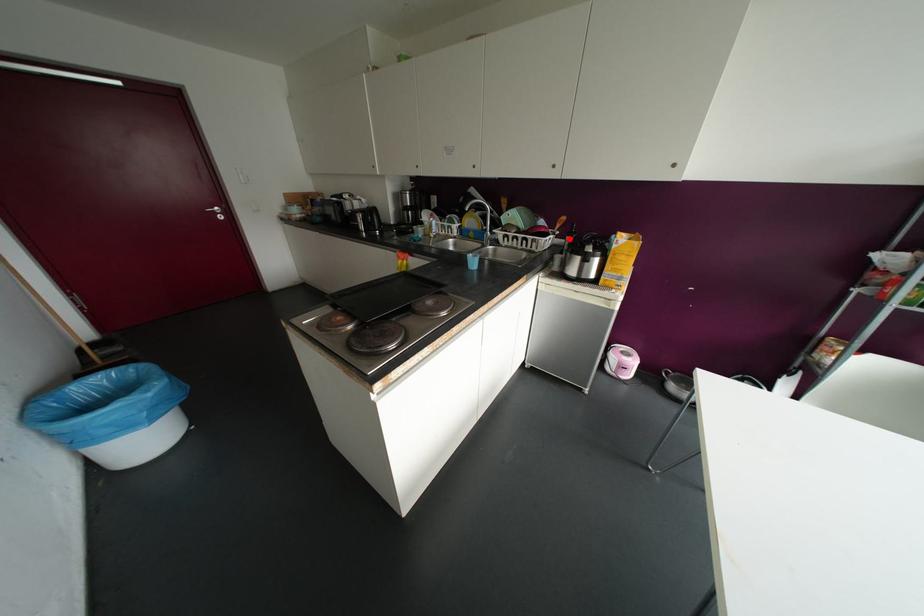
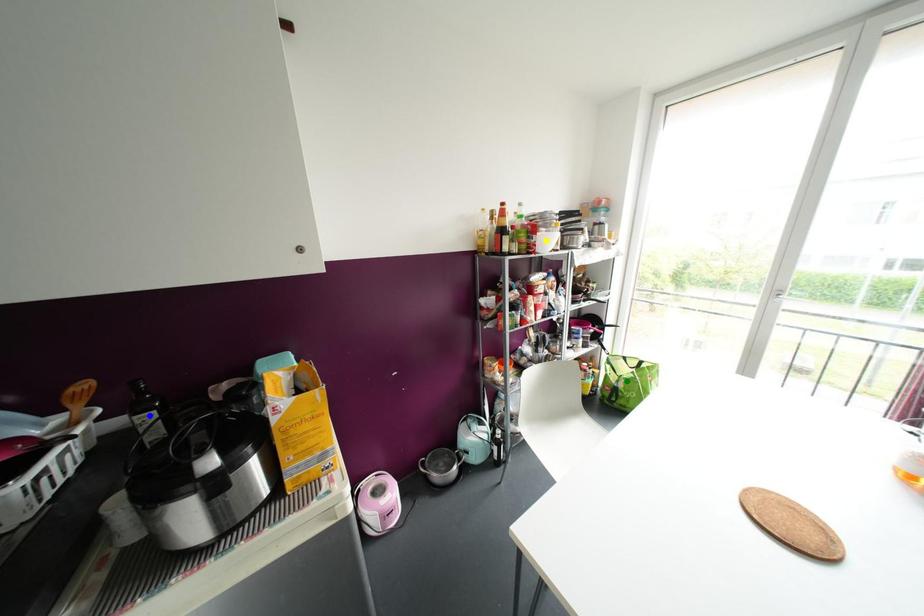
Question: I am providing you with two images of the same scene from different viewpoints. A red point is marked on the first image. You are given multiple points on the second image. Which point in image 2 is actually the same real-world point as the red point in image 1?

Choices:
 (A) green point
 (B) blue point
 (C) yellow point

Answer: (B)